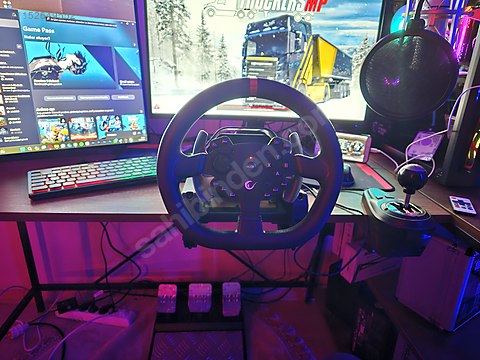
This screenshot has width=480, height=360. I want to click on horizontal crossmember bottom of table, so click(253, 284), click(112, 286).